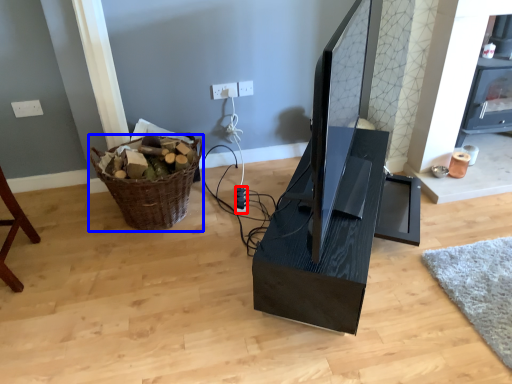
Question: Which object is closer to the camera taking this photo, plug (highlighted by a red box) or basket (highlighted by a blue box)?

Choices:
 (A) plug
 (B) basket

Answer: (B)